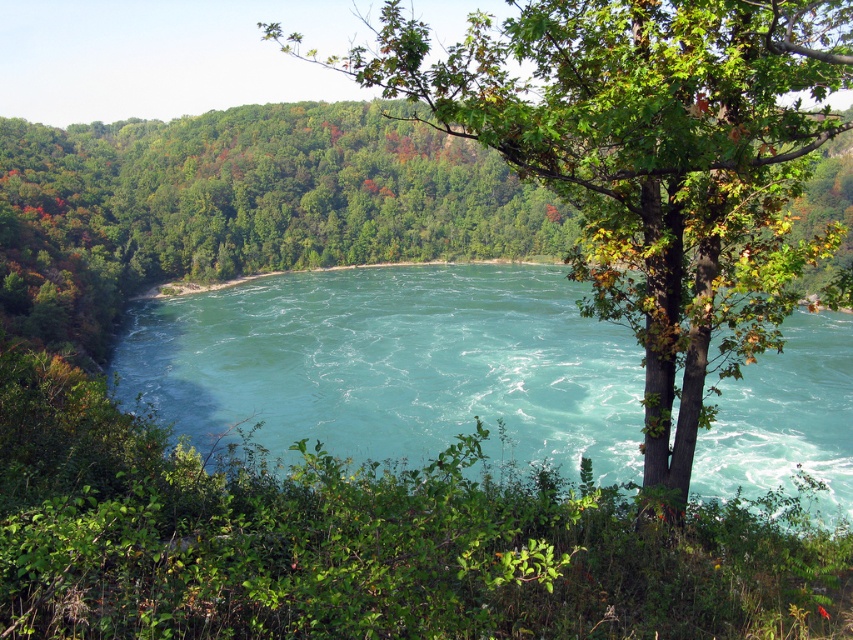
You are planning to take a photo of the green leafy tree at center and the turquoise water at center. Which object will appear taller in the photo?

The green leafy tree at center will appear taller in the photo because it has a greater height compared to the turquoise water at center.

In the scene shown: You are planning to take a photo of the green leafy tree at center and the turquoise water at center. Which object will occupy more space in your photo?

The green leafy tree at center has a larger size compared to the turquoise water at center, so it will occupy more space in the photo.

You are standing in the forest looking at the scene. Which object is positioned to the right of the other between the green leafy tree at center and the turquoise water at center?

The green leafy tree at center is positioned to the right of the turquoise water at center.